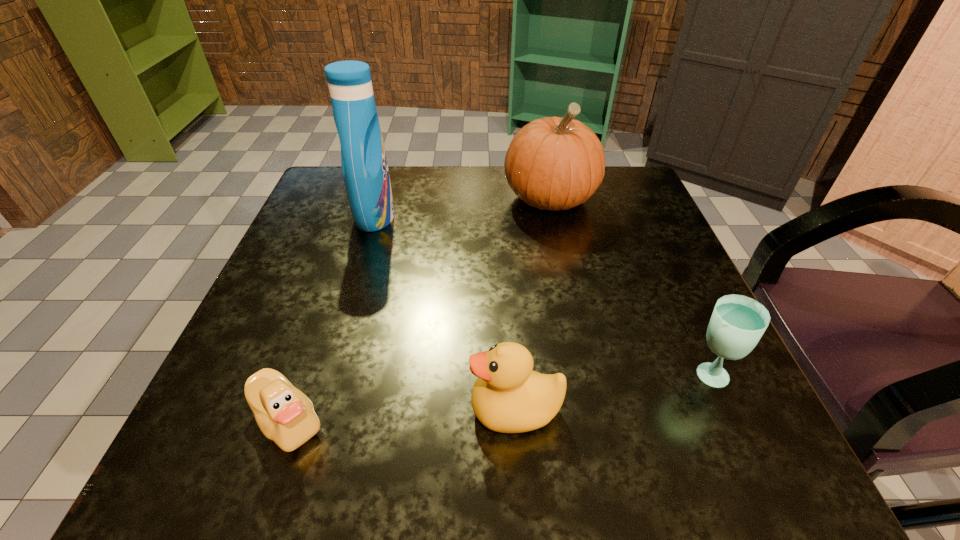
This screenshot has width=960, height=540. What are the coordinates of `blank area located at the beak of the right duck` in the screenshot? It's located at tap(345, 409).

The height and width of the screenshot is (540, 960). I want to click on vacant space positioned at the beak of the right duck, so click(404, 409).

Where is `detergent located at the far edge`? This screenshot has height=540, width=960. detergent located at the far edge is located at coordinates (365, 171).

I want to click on pumpkin positioned at the far edge, so click(554, 163).

At what (x,y) coordinates should I click in order to perform the action: click on detergent that is at the left edge. Please return your answer as a coordinate pair (x, y). The width and height of the screenshot is (960, 540). Looking at the image, I should click on (365, 171).

Identify the location of duck present at the left edge. (285, 415).

Where is `pumpkin present at the right edge`? This screenshot has width=960, height=540. pumpkin present at the right edge is located at coordinates (554, 163).

What are the coordinates of `glass that is at the right edge` in the screenshot? It's located at (738, 322).

Where is `object positioned at the far left corner`? object positioned at the far left corner is located at coordinates (365, 171).

You are a GUI agent. You are given a task and a screenshot of the screen. Output one action in this format:
    pyautogui.click(x=<x>, y=<y>)
    Task: Click on the object present at the near left corner
    The width and height of the screenshot is (960, 540).
    Given the screenshot: What is the action you would take?
    pyautogui.click(x=285, y=415)